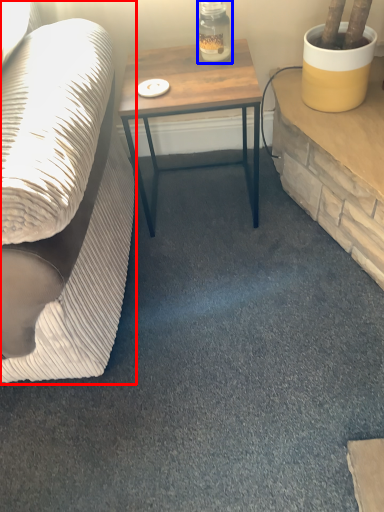
Question: Among these objects, which one is nearest to the camera, studio couch (highlighted by a red box) or bottle (highlighted by a blue box)?

Choices:
 (A) studio couch
 (B) bottle

Answer: (A)